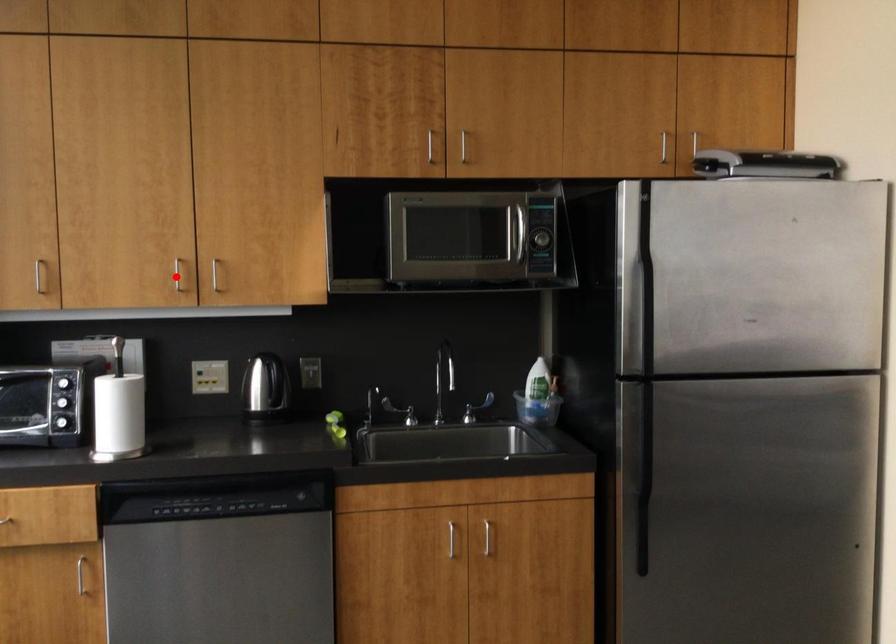
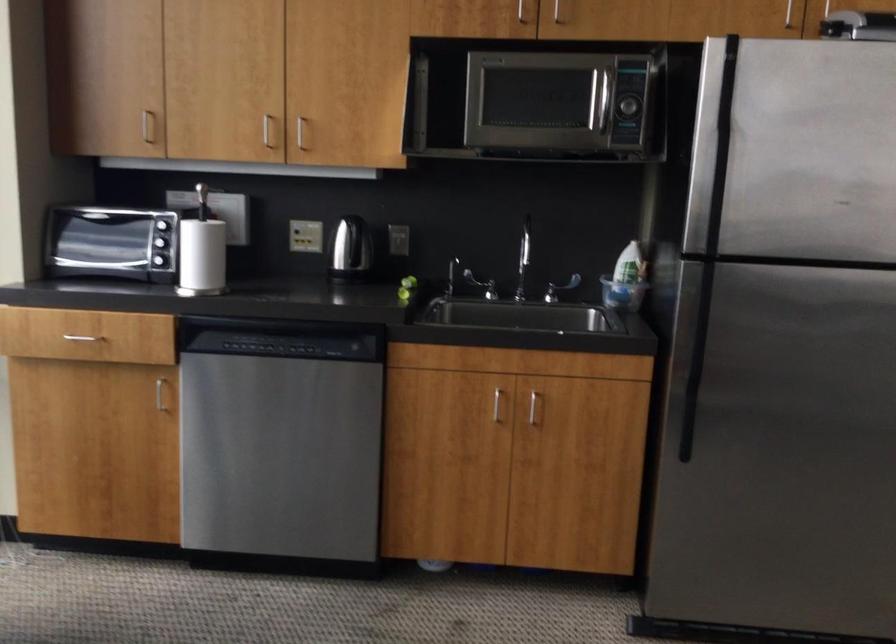
Where in the second image is the point corresponding to the highlighted location from the first image?

(266, 129)